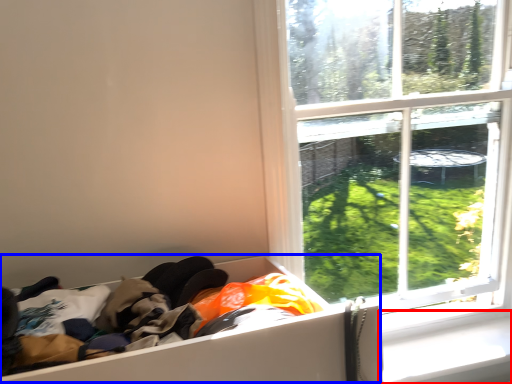
Question: Which object appears farthest to the camera in this image, window sill (highlighted by a red box) or storage box (highlighted by a blue box)?

Choices:
 (A) window sill
 (B) storage box

Answer: (A)